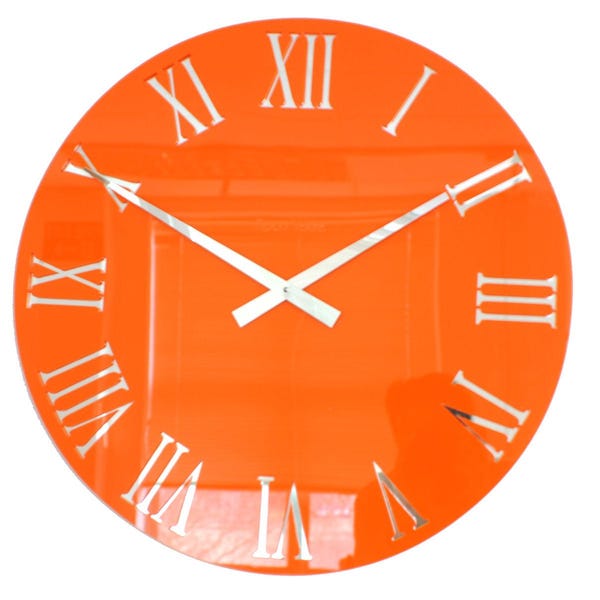
The height and width of the screenshot is (600, 600). I want to click on clock face, so click(289, 240), click(286, 344).